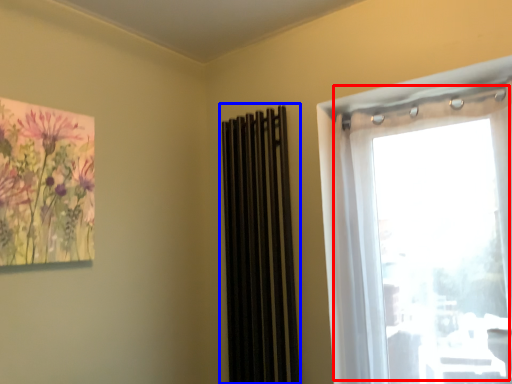
Question: Which of the following is the farthest to the observer, window (highlighted by a red box) or curtain (highlighted by a blue box)?

Choices:
 (A) window
 (B) curtain

Answer: (B)